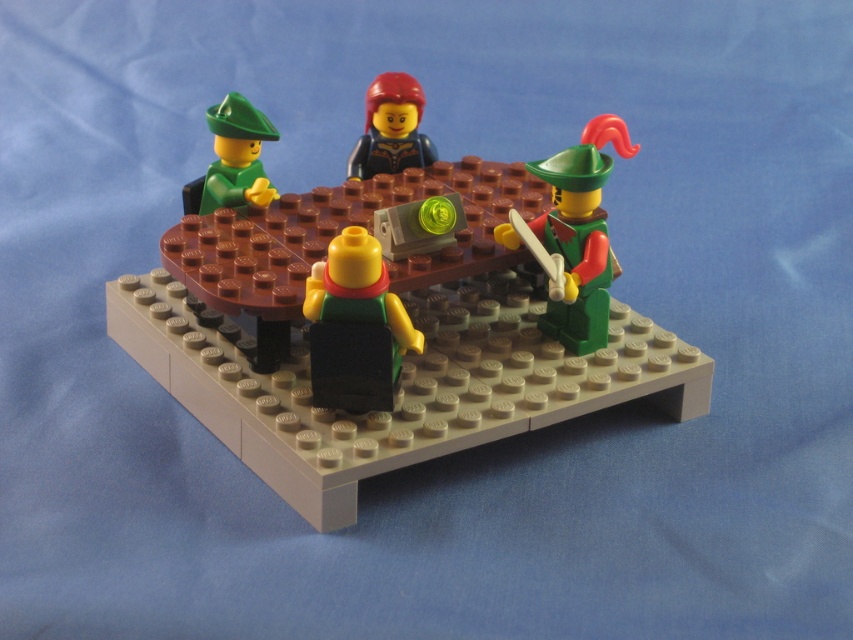
Based on the photo, you are a LEGO enthusiast who wants to place a new LEGO piece between the matte green minifigure at center and the green matte minifigure at right. The piece you want to place is 7 inches long. Will it fit between them?

The distance between the matte green minifigure at center and the green matte minifigure at right is 8.01 inches. Since the new LEGO piece is 7 inches long, it will fit between them with some space remaining.

Looking at this image, you are a LEGO enthusiast examining the scene. You notice a point marked at coordinates (390, 326). What object is located at this point?

The point at coordinates (390, 326) marks the brown matte table at center.

You are a LEGO enthusiast planning to place a new LEGO piece between the green matte minifigure at right and the smooth black minifigure at center. The new piece is 5 inches long. Will there be enough space between them to fit the new piece?

The distance between the green matte minifigure at right and the smooth black minifigure at center is 7.86 inches. Since the new piece is 5 inches long, there is sufficient space to place it between them.